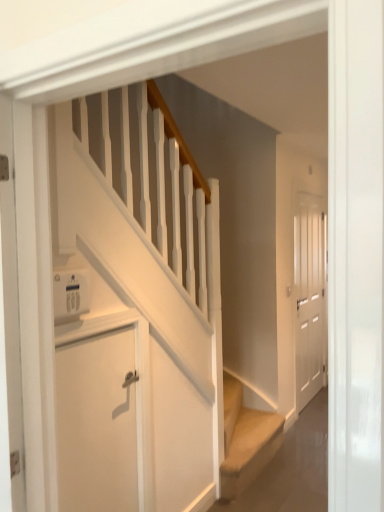
What do you see at coordinates (310, 298) in the screenshot? This screenshot has height=512, width=384. I see `white matte door at right, arranged as the 2th door when viewed from the front` at bounding box center [310, 298].

Measure the distance between point (x=84, y=495) and camera.

Point (x=84, y=495) and camera are 1.71 meters apart.

The height and width of the screenshot is (512, 384). Describe the element at coordinates (97, 423) in the screenshot. I see `white matte door at lower left, which appears as the first door when viewed from the left` at that location.

Find the location of a particular element. The height and width of the screenshot is (512, 384). white matte door at right, arranged as the 2th door when viewed from the front is located at coordinates (310, 298).

Does white matte door at right, arranged as the 2th door when viewed from the front, appear on the left side of white matte door at lower left, which appears as the first door when viewed from the left?

Incorrect, white matte door at right, arranged as the 2th door when viewed from the front, is not on the left side of white matte door at lower left, which appears as the first door when viewed from the left.

From the image's perspective, is white matte door at right, arranged as the 2th door when viewed from the front, above white matte door at lower left, which appears as the first door when viewed from the left?

Yes, from the image's perspective, white matte door at right, arranged as the 2th door when viewed from the front, is on top of white matte door at lower left, which appears as the first door when viewed from the left.

How much distance is there between white matte door at right, which appears as the 1th door when viewed from the right, and white matte door at lower left, the second door positioned from the back?

white matte door at right, which appears as the 1th door when viewed from the right, and white matte door at lower left, the second door positioned from the back, are 7.95 feet apart.

Does white matte door at right, which appears as the 1th door when viewed from the right, have a larger size compared to white matte door at lower left, which ranks as the second door in right-to-left order?

Yes, white matte door at right, which appears as the 1th door when viewed from the right, is bigger than white matte door at lower left, which ranks as the second door in right-to-left order.

Is white matte door at lower left, which ranks as the second door in right-to-left order, further to camera compared to white plastic thermostat at upper left?

Yes, white matte door at lower left, which ranks as the second door in right-to-left order, is further from the viewer.

Which object is positioned more to the right, white matte door at lower left, which ranks as the second door in right-to-left order, or white plastic thermostat at upper left?

Positioned to the right is white matte door at lower left, which ranks as the second door in right-to-left order.

Based on the photo, which object is thinner, white matte door at lower left, which ranks as the second door in right-to-left order, or white plastic thermostat at upper left?

white matte door at lower left, which ranks as the second door in right-to-left order.

Considering the relative positions of white matte door at right, which appears as the 1th door when viewed from the right, and white plastic thermostat at upper left in the image provided, is white matte door at right, which appears as the 1th door when viewed from the right, to the right of white plastic thermostat at upper left from the viewer's perspective?

Yes.

From the image's perspective, is white matte door at right, arranged as the 2th door when viewed from the front, below white plastic thermostat at upper left?

Yes, from the image's perspective, white matte door at right, arranged as the 2th door when viewed from the front, is beneath white plastic thermostat at upper left.

Is white matte door at right, the 1th door viewed from the back, positioned beyond the bounds of white plastic thermostat at upper left?

Yes, white matte door at right, the 1th door viewed from the back, is located beyond the bounds of white plastic thermostat at upper left.

Is point (78, 277) closer or farther from the camera than point (94, 472)?

Point (78, 277).

Between white plastic thermostat at upper left and white matte door at lower left, the second door positioned from the back, which one has larger size?

white matte door at lower left, the second door positioned from the back, is bigger.

Which is behind, white plastic thermostat at upper left or white matte door at lower left, which ranks as the second door in right-to-left order?

white matte door at lower left, which ranks as the second door in right-to-left order, is further from the camera.

The image size is (384, 512). Find the location of `the 2nd door positioned below the white plastic thermostat at upper left (from a real-world perspective)`. the 2nd door positioned below the white plastic thermostat at upper left (from a real-world perspective) is located at coordinates (97, 423).

From a real-world perspective, is white plastic thermostat at upper left positioned under white matte door at right, arranged as the 2th door when viewed from the front, based on gravity?

No, from a real-world perspective, white plastic thermostat at upper left is not beneath white matte door at right, arranged as the 2th door when viewed from the front.

From the image's perspective, is white plastic thermostat at upper left under white matte door at right, the 1th door viewed from the back?

No.

Considering the relative sizes of white plastic thermostat at upper left and white matte door at right, the 1th door viewed from the back, in the image provided, is white plastic thermostat at upper left thinner than white matte door at right, the 1th door viewed from the back,?

In fact, white plastic thermostat at upper left might be wider than white matte door at right, the 1th door viewed from the back.

Is point (82, 293) positioned after point (299, 406)?

No, (82, 293) is closer to viewer.

Which is closer to the camera, (x=59, y=504) or (x=298, y=329)?

Positioned in front is point (x=59, y=504).

Looking at their sizes, would you say white matte door at lower left, which appears as the first door when viewed from the left, is wider or thinner than white matte door at right, the second door in the left-to-right sequence?

In the image, white matte door at lower left, which appears as the first door when viewed from the left, appears to be more narrow than white matte door at right, the second door in the left-to-right sequence.

Is white matte door at lower left, which appears as the 1th door when viewed from the front, positioned beyond the bounds of white matte door at right, arranged as the 2th door when viewed from the front?

Yes, white matte door at lower left, which appears as the 1th door when viewed from the front, is located beyond the bounds of white matte door at right, arranged as the 2th door when viewed from the front.

Can you confirm if white matte door at lower left, which ranks as the second door in right-to-left order, is positioned to the left of white matte door at right, arranged as the 2th door when viewed from the front?

Correct, you'll find white matte door at lower left, which ranks as the second door in right-to-left order, to the left of white matte door at right, arranged as the 2th door when viewed from the front.

Where is `door on the right of white matte door at lower left, which appears as the 1th door when viewed from the front`? Image resolution: width=384 pixels, height=512 pixels. door on the right of white matte door at lower left, which appears as the 1th door when viewed from the front is located at coordinates (310, 298).

From the image's perspective, starting from the white plastic thermostat at upper left, which door is the 2nd one below? Please provide its 2D coordinates.

[(97, 423)]

Looking at the image, which one is located further to white plastic thermostat at upper left, white matte door at right, which appears as the 1th door when viewed from the right, or white matte door at lower left, which appears as the first door when viewed from the left?

Based on the image, white matte door at right, which appears as the 1th door when viewed from the right, appears to be further to white plastic thermostat at upper left.

Considering their positions, is white plastic thermostat at upper left positioned further to white matte door at lower left, which appears as the first door when viewed from the left, than white matte door at right, which appears as the 1th door when viewed from the right?

white matte door at right, which appears as the 1th door when viewed from the right, lies further to white matte door at lower left, which appears as the first door when viewed from the left, than the other object.

When comparing their distances from white matte door at right, the 1th door viewed from the back, does white plastic thermostat at upper left or white matte door at lower left, which ranks as the second door in right-to-left order, seem closer?

white matte door at lower left, which ranks as the second door in right-to-left order, is positioned closer to the anchor white matte door at right, the 1th door viewed from the back.

When comparing their distances from white matte door at lower left, which ranks as the second door in right-to-left order, does white matte door at right, which appears as the 1th door when viewed from the right, or white plastic thermostat at upper left seem further?

Among the two, white matte door at right, which appears as the 1th door when viewed from the right, is located further to white matte door at lower left, which ranks as the second door in right-to-left order.

Looking at the image, which one is located further to white matte door at right, the 1th door viewed from the back, white matte door at lower left, the second door positioned from the back, or white plastic thermostat at upper left?

white plastic thermostat at upper left.

Considering their positions, is white matte door at lower left, which appears as the first door when viewed from the left, positioned closer to white plastic thermostat at upper left than white matte door at right, the second door in the left-to-right sequence?

Based on the image, white matte door at lower left, which appears as the first door when viewed from the left, appears to be nearer to white plastic thermostat at upper left.

Locate an element on the screen. This screenshot has width=384, height=512. door located between white plastic thermostat at upper left and white matte door at right, which appears as the 1th door when viewed from the right, in the depth direction is located at coordinates (97, 423).